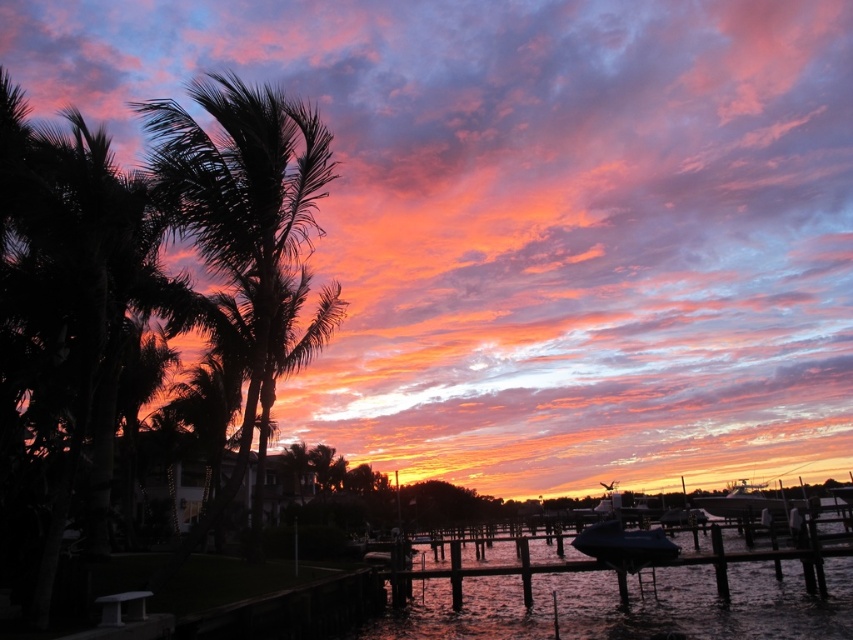
You are standing at point (190,308) and want to reach the dock. The dock is 14.47 meters away. Can you walk directly to the dock from your current position?

Yes, you can walk directly to the dock from point (190,308) since the distance between them is 14.47 meters, which is a straight path.

You are a photographer planning to capture the sunset with both the blue tarpaulin boat at lower right and the shiny blue boat at lower right in the frame. Given that your camera has a maximum focal length of 50 meters, will you be able to include both boats in the shot?

The distance between the blue tarpaulin boat at lower right and the shiny blue boat at lower right is 15.80 meters. Since your camera can capture up to 50 meters, both boats will fit within the frame as the distance between them is well within the camera range.

You are standing on the wooden dock and want to take a photo of the silky black palm tree at left and the blue tarpaulin boat at lower right. Which object should you position closer to the camera to ensure both are in focus?

You should position the silky black palm tree at left closer to the camera because it is in front of the blue tarpaulin boat at lower right, so adjusting focus to the closer object will help both be in focus.